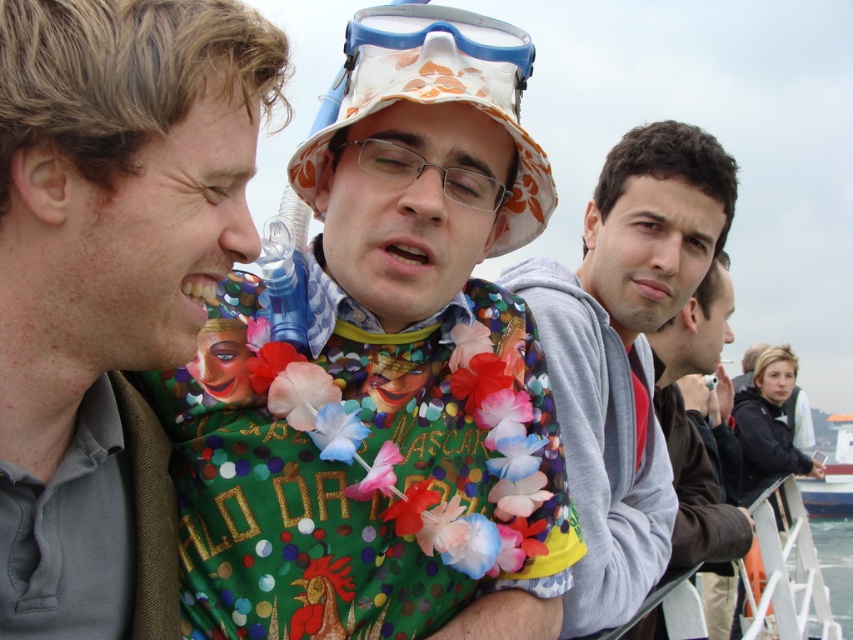
You are observing a group of people on a boat. You notice two individuals wearing the green fabric shirt at center and the gray fleece jacket at center. Which of these two is positioned closer to you?

The green fabric shirt at center is closer to the viewer than the gray fleece jacket at center.

You are standing on the deck of the boat and want to reach the point at coordinates point (167,588). If your maximum comfortable walking distance is 50 feet, will you be able to comfortably walk to that point?

The distance of point (167,588) from camera is 51.90 feet, which exceeds your maximum comfortable walking distance of 50 feet. Therefore, you may find it uncomfortable to walk to that point.

You are standing in front of the boat scene. There are two points marked in the image. The first point is at coordinates point (27,42) and the second is at point (693,125). Which point is closer to you?

Point (27,42) is closer to the camera than point (693,125).